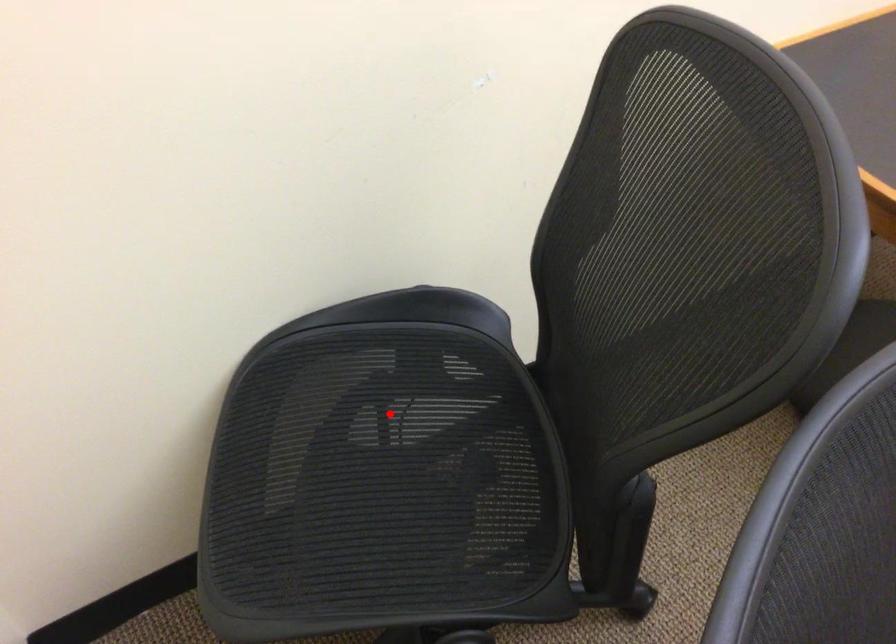
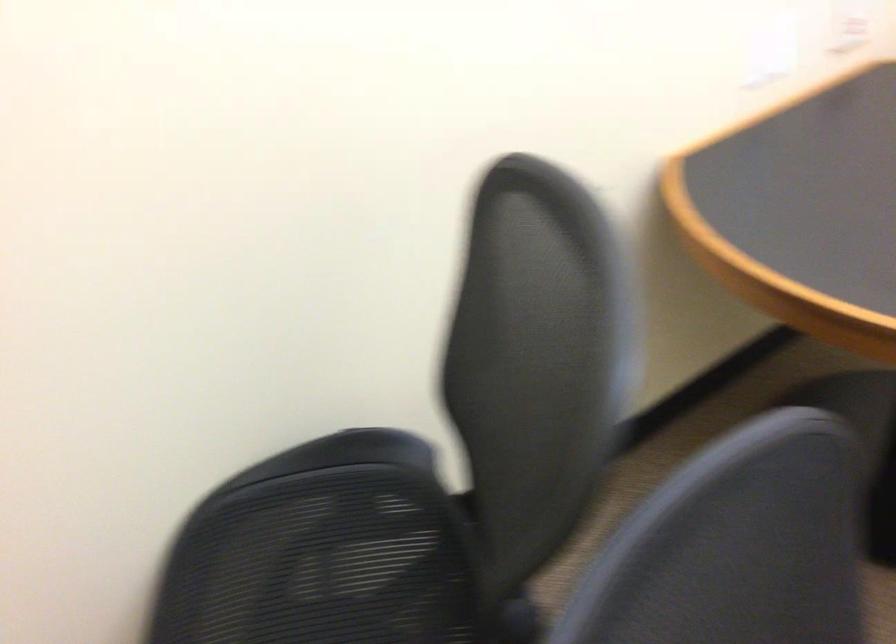
Question: I am providing you with two images of the same scene from different viewpoints. A red point is marked on the first image. Can you still see the location of the red point in image 2?

Choices:
 (A) Yes
 (B) No

Answer: (A)